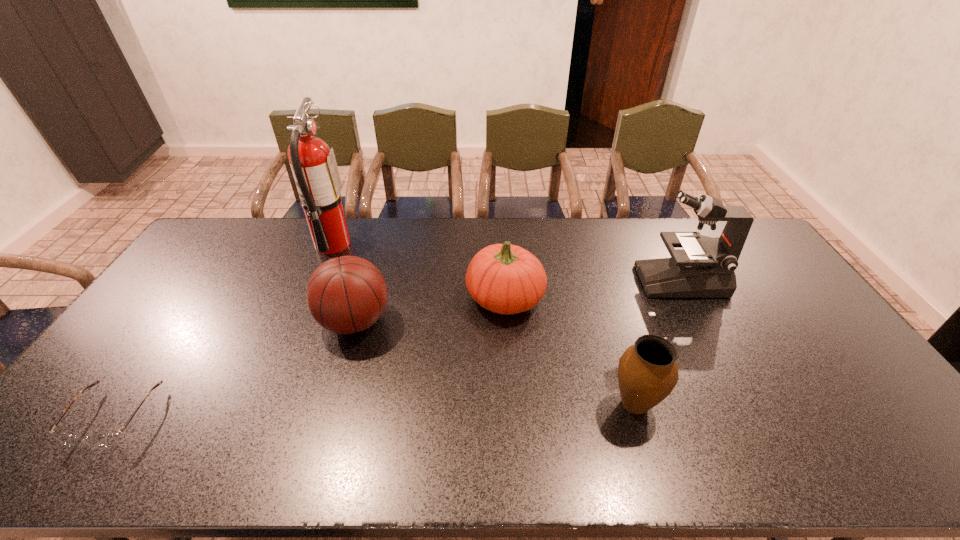
This screenshot has width=960, height=540. Find the location of `free area in between the fourth object from left to right and the second object from right to left`. free area in between the fourth object from left to right and the second object from right to left is located at coordinates (570, 351).

What are the coordinates of `vacant area that lies between the shortest object and the microscope` in the screenshot? It's located at (398, 348).

The image size is (960, 540). I want to click on free spot between the third object from right to left and the basketball, so click(430, 309).

Locate an element on the screen. The width and height of the screenshot is (960, 540). object that stands as the second closest to the fifth object from left to right is located at coordinates (705, 267).

The height and width of the screenshot is (540, 960). I want to click on object that is the fifth closest to the fourth object from left to right, so click(x=108, y=440).

Where is `vacant area in the image that satisfies the following two spatial constraints: 1. on the nozzle side of the fourth object from left to right; 2. on the left side of the fire extinguisher`? vacant area in the image that satisfies the following two spatial constraints: 1. on the nozzle side of the fourth object from left to right; 2. on the left side of the fire extinguisher is located at coordinates (309, 298).

Where is `vacant region that satisfies the following two spatial constraints: 1. on the nozzle side of the tallest object; 2. on the right side of the basketball`? Image resolution: width=960 pixels, height=540 pixels. vacant region that satisfies the following two spatial constraints: 1. on the nozzle side of the tallest object; 2. on the right side of the basketball is located at coordinates (300, 321).

You are a GUI agent. You are given a task and a screenshot of the screen. Output one action in this format:
    pyautogui.click(x=<x>, y=<y>)
    Task: Click on the free location that satisfies the following two spatial constraints: 1. on the nozzle side of the urn; 2. on the right side of the tallest object
    The image size is (960, 540).
    Given the screenshot: What is the action you would take?
    click(265, 404)

Where is `free space that satisfies the following two spatial constraints: 1. through the eyepieces of the rightmost object; 2. on the front side of the urn`? This screenshot has width=960, height=540. free space that satisfies the following two spatial constraints: 1. through the eyepieces of the rightmost object; 2. on the front side of the urn is located at coordinates (744, 404).

I want to click on vacant region that satisfies the following two spatial constraints: 1. through the eyepieces of the fifth shortest object; 2. on the front side of the basketball, so click(x=702, y=321).